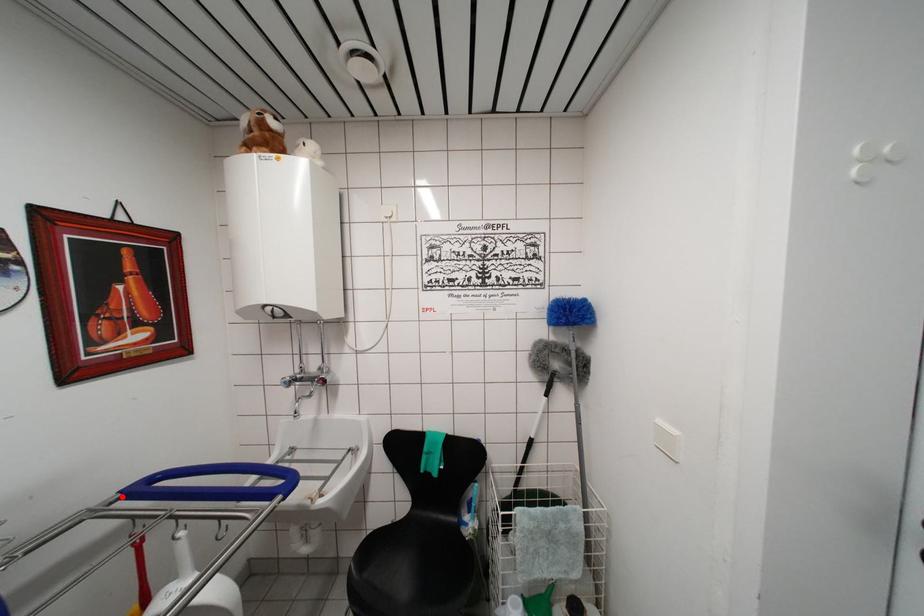
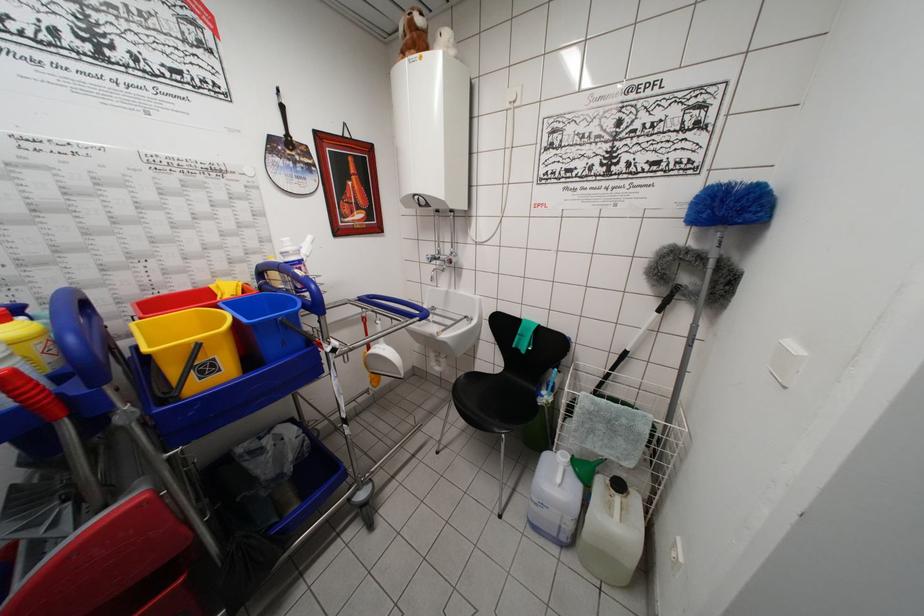
Find the pixel in the second image that matches the highlighted location in the first image.

(360, 302)